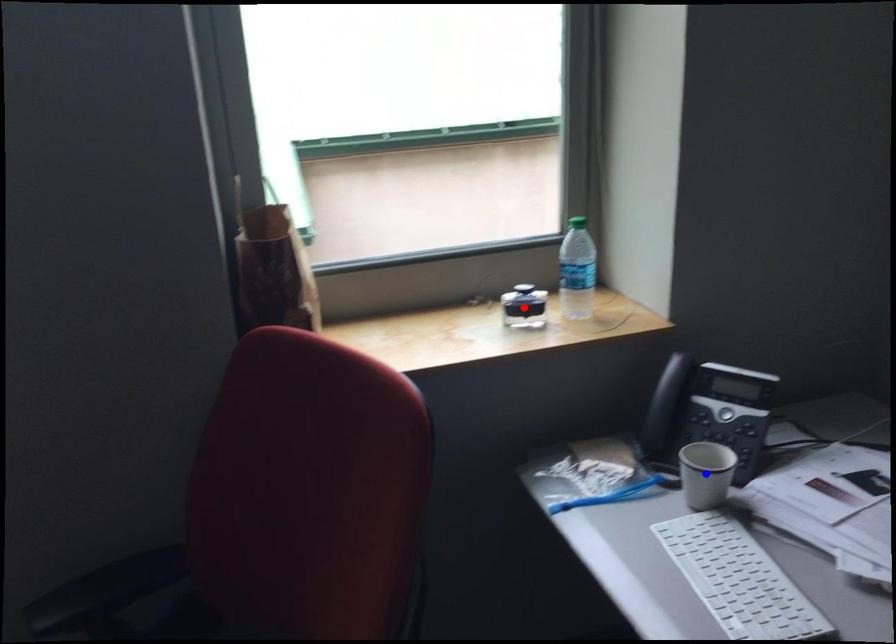
Question: In the image, two points are highlighted. Which point is nearer to the camera? Reply with the corresponding letter.

Choices:
 (A) blue point
 (B) red point

Answer: (A)